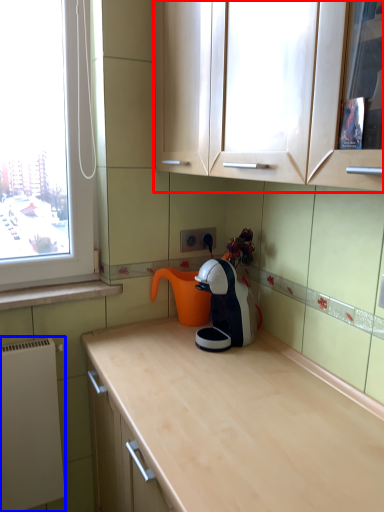
Question: Which of the following is the farthest to the observer, cabinetry (highlighted by a red box) or appliance (highlighted by a blue box)?

Choices:
 (A) cabinetry
 (B) appliance

Answer: (B)